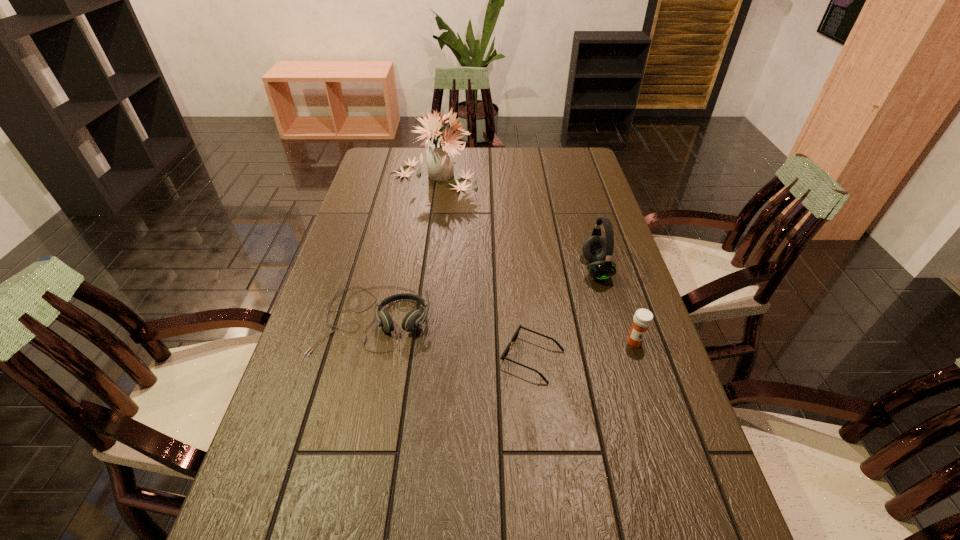
In order to click on headset present at the left edge in this screenshot , I will do (x=414, y=318).

The image size is (960, 540). Find the location of `headset located in the right edge section of the desktop`. headset located in the right edge section of the desktop is located at coordinates (596, 248).

Locate an element on the screen. The height and width of the screenshot is (540, 960). medicine that is at the right edge is located at coordinates (642, 319).

Identify the location of object that is at the far left corner. pos(439,149).

In the image, there is a desktop. Where is `vacant space at the left edge`? vacant space at the left edge is located at coordinates 349,368.

In the image, there is a desktop. Where is `free space at the right edge`? The image size is (960, 540). free space at the right edge is located at coordinates (575, 206).

Where is `free space between the second tallest object and the medicine`? This screenshot has width=960, height=540. free space between the second tallest object and the medicine is located at coordinates (615, 306).

Where is `free spot between the shortest object and the second shortest object`? This screenshot has height=540, width=960. free spot between the shortest object and the second shortest object is located at coordinates (453, 339).

Locate an element on the screen. Image resolution: width=960 pixels, height=540 pixels. free area in between the shorter headset and the second tallest object is located at coordinates coord(485,294).

Locate an element on the screen. Image resolution: width=960 pixels, height=540 pixels. empty location between the third tallest object and the shorter headset is located at coordinates (504, 331).